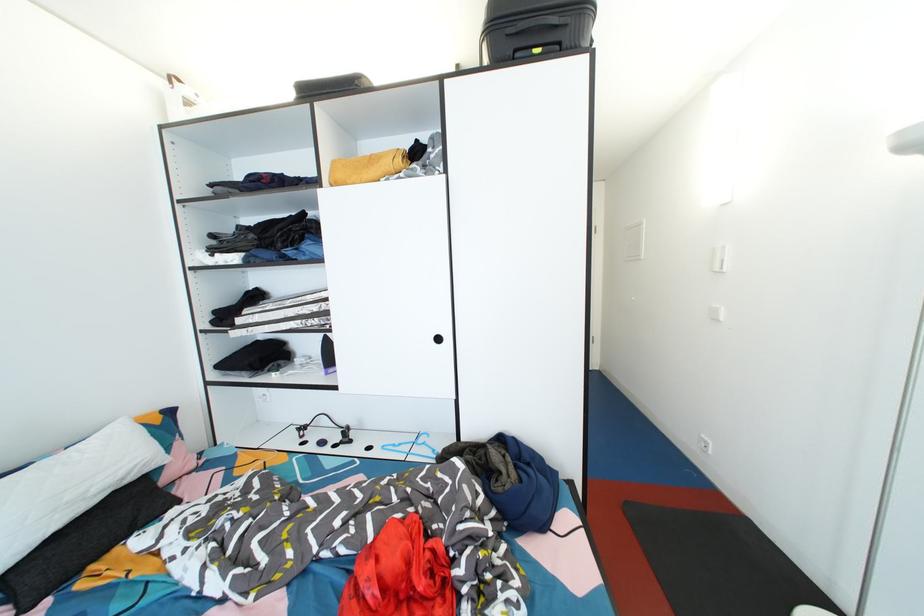
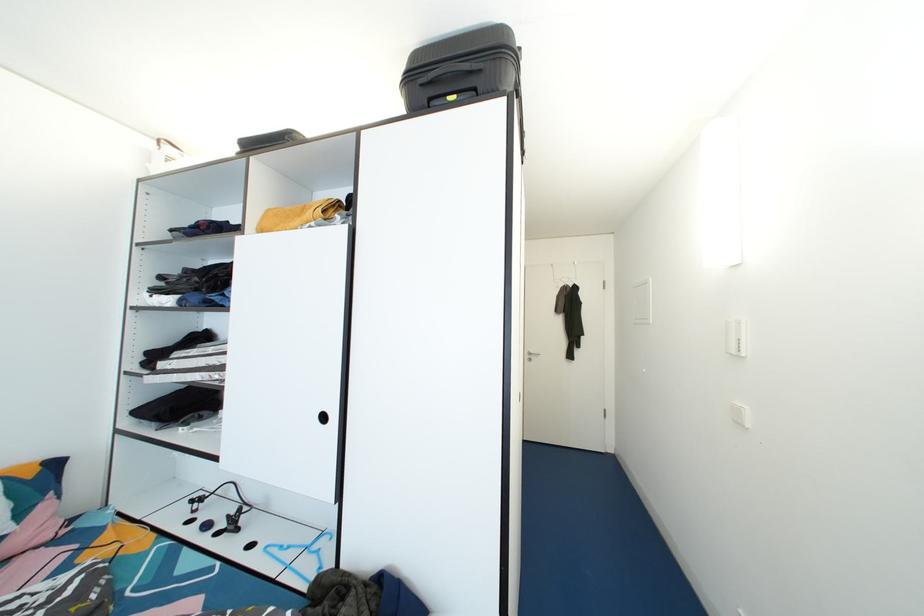
What movement of the cameraman would produce the second image?

The cameraman walked toward right, forward.